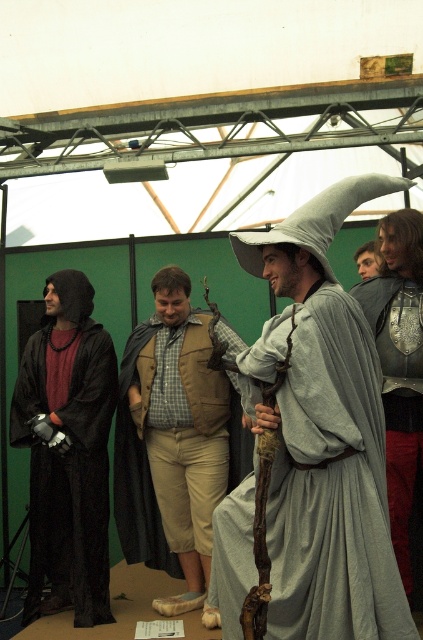
You are a costume designer assessing the proportions of the wizard costume. Given the gray fabric wizard hat at center and the tan suede vest at center, which item would you say is bigger in size?

The gray fabric wizard hat at center is larger in size than the tan suede vest at center.

You are a photographer at the event and need to capture a photo that includes both the gray fabric wizard hat at center and the metallic silver armor at right. What is the minimum distance you need to maintain between the camera and the subjects to ensure both are in frame?

The gray fabric wizard hat at center is 32.09 inches away from the metallic silver armor at right. To include both in the frame, the photographer should position the camera at least 32.09 inches away from the closest subject, ensuring both are within the camera lens range.

You are a photographer at the event and need to capture a clear photo of both the gray fabric wizard hat at center and the tan suede vest at center. However, you can only focus on one object at a time. Which object should you focus on to ensure the other is still visible in the background?

You should focus on the gray fabric wizard hat at center because it is in front of the tan suede vest at center, so if you focus on the hat, the vest will be in the background and still visible.